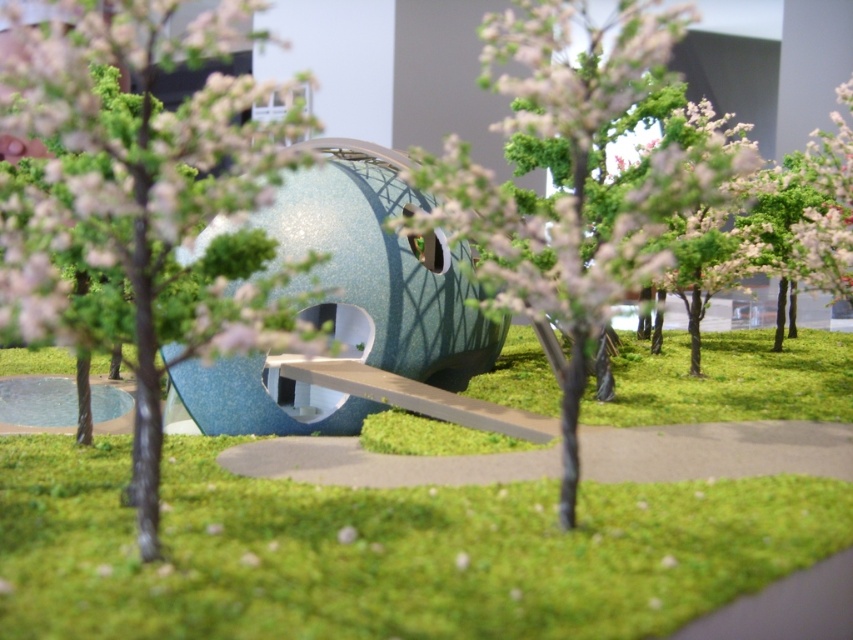
Does point (477, 584) lie behind point (219, 250)?

That is False.

Between green grass at center and green leafy tree at center, which one appears on the left side from the viewer's perspective?

From the viewer's perspective, green leafy tree at center appears more on the left side.

Between point (292, 515) and point (39, 44), which one is positioned behind?

Positioned behind is point (292, 515).

Identify the location of green grass at center. The image size is (853, 640). (386, 550).

Is green leafy tree at center thinner than green matte tree at center?

Correct, green leafy tree at center's width is less than green matte tree at center's.

Between green leafy tree at center and green matte tree at center, which one is positioned higher?

green matte tree at center is higher up.

Which is in front, point (26, 54) or point (585, 81)?

Point (26, 54) is more forward.

Identify the location of green leafy tree at center. (140, 209).

Is green grass at center below green matte tree at center?

Yes.

Is green grass at center smaller than green matte tree at center?

Correct, green grass at center occupies less space than green matte tree at center.

Between point (424, 449) and point (613, 17), which one is positioned behind?

The point (613, 17) is behind.

Image resolution: width=853 pixels, height=640 pixels. I want to click on green grass at center, so click(x=386, y=550).